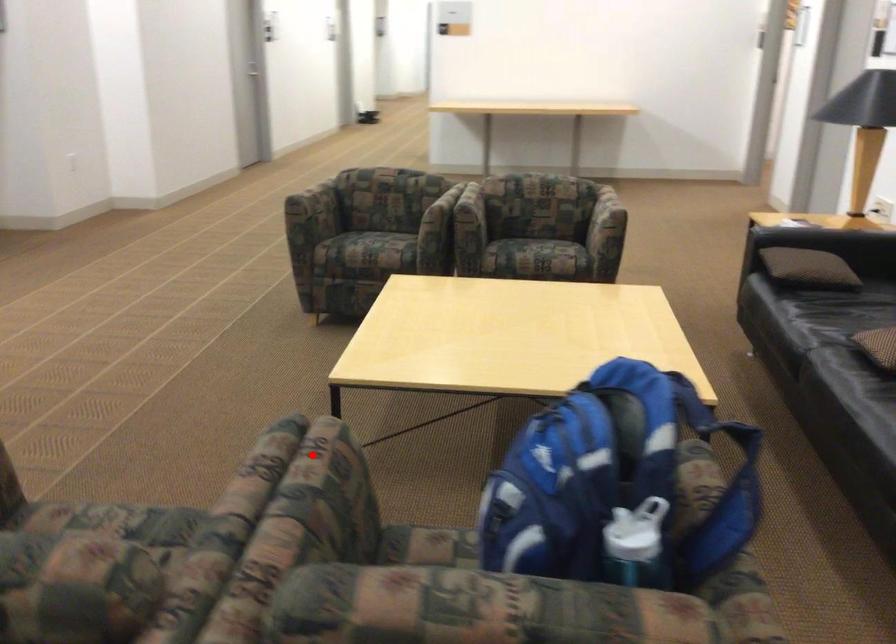
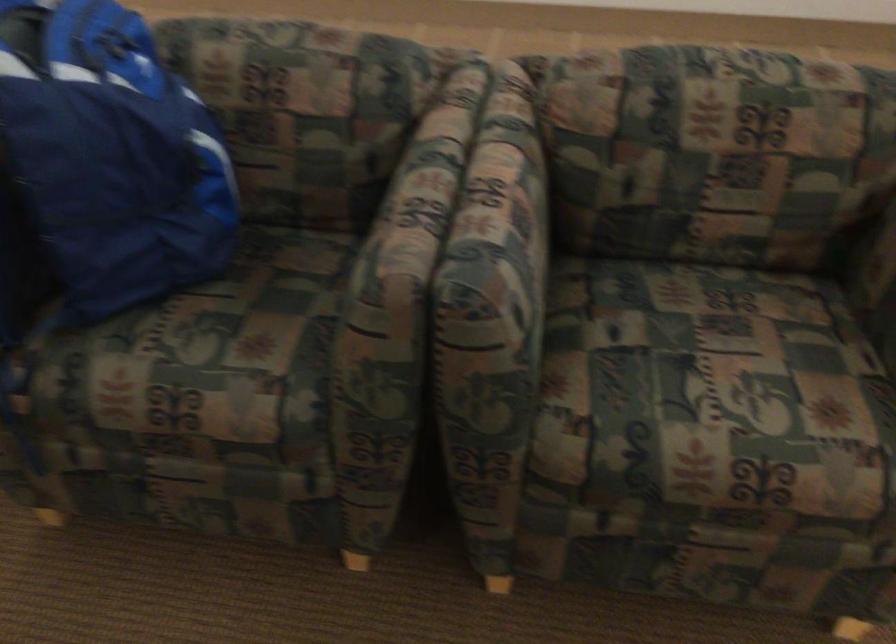
Question: I am providing you with two images of the same scene from different viewpoints. Given a red point in image1, look at the same physical point in image2. Is it:

Choices:
 (A) Closer to the viewpoint
 (B) Farther from the viewpoint

Answer: (A)